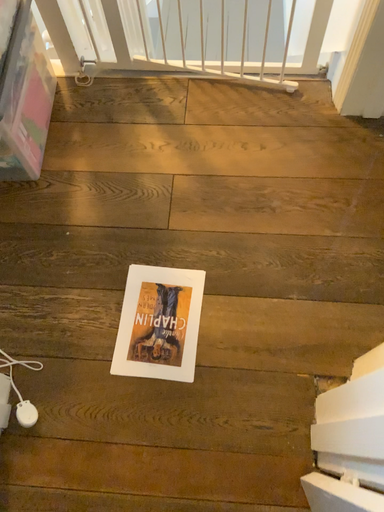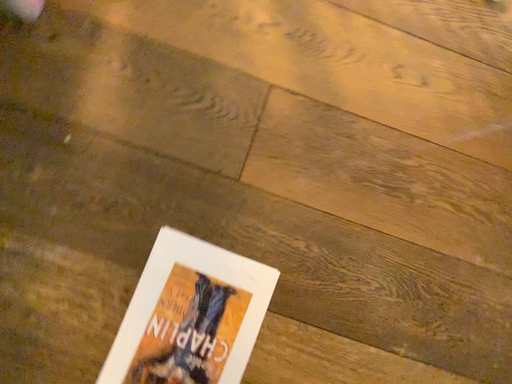
Question: How did the camera likely rotate when shooting the video?

Choices:
 (A) rotated downward
 (B) rotated upward

Answer: (A)